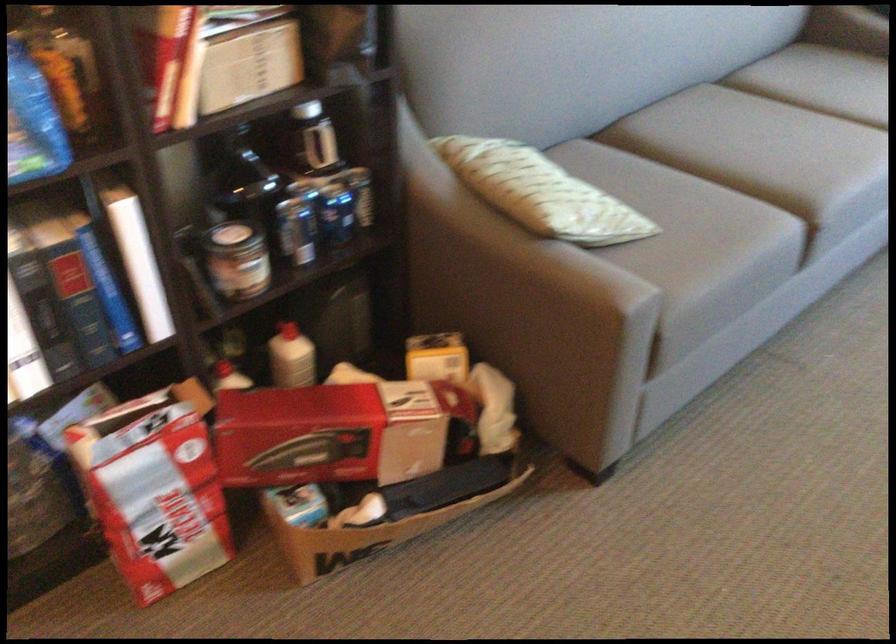
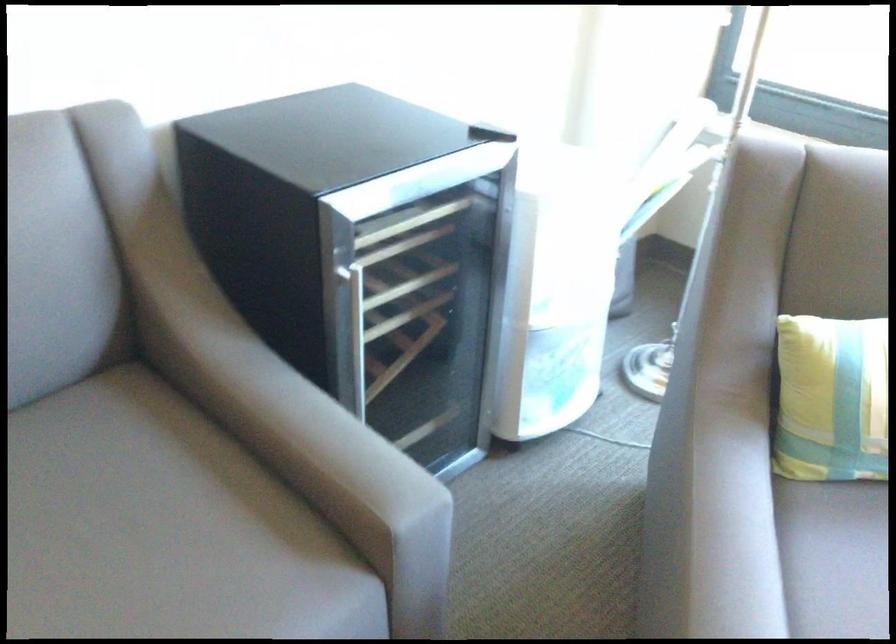
Based on the photo, the images are taken continuously from a first-person perspective. In which direction are you moving?

The cameraman walked toward right, forward.